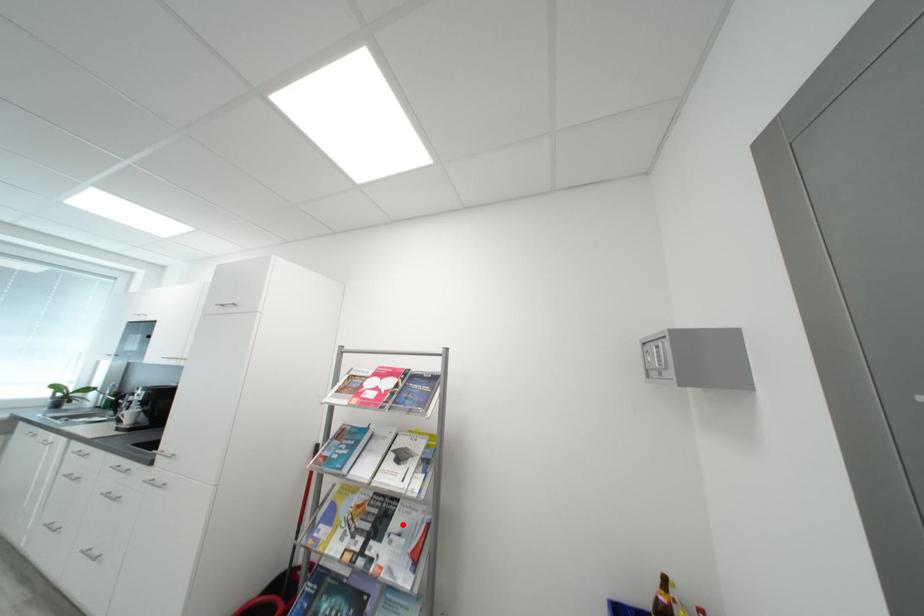
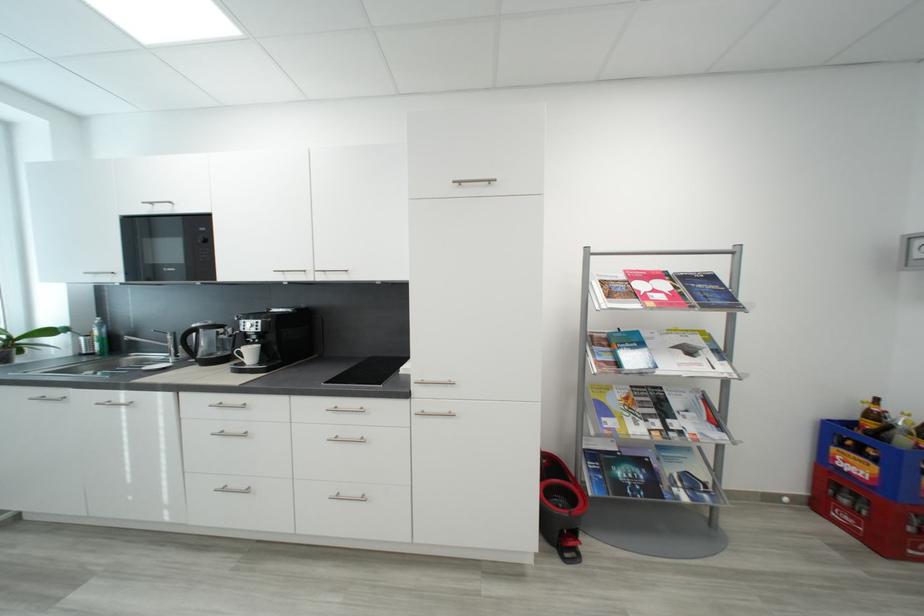
In the second image, find the point that corresponds to the highlighted location in the first image.

(684, 406)